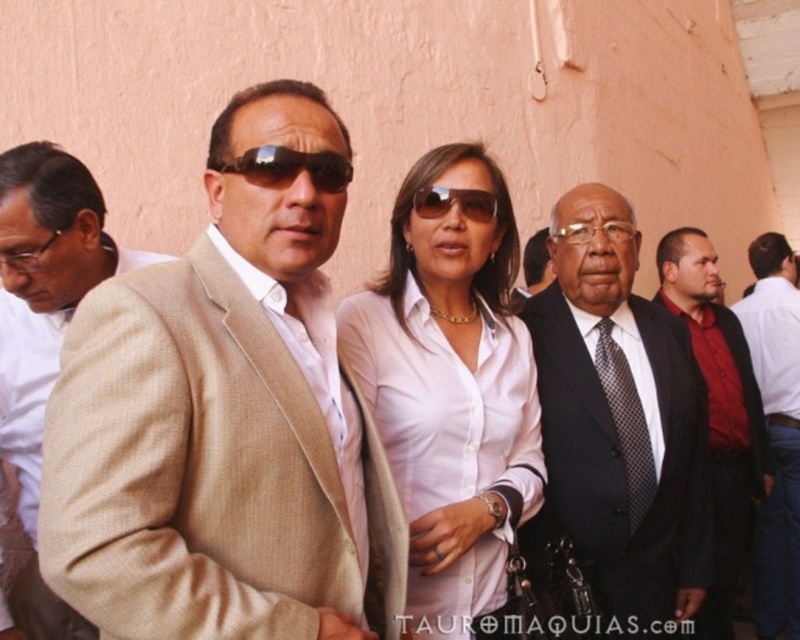
Question: Does dark blue suit at center appear under beige textured suit at left?

Choices:
 (A) yes
 (B) no

Answer: (A)

Question: Does dark red shirt at center lie behind black reflective sunglasses at center?

Choices:
 (A) yes
 (B) no

Answer: (A)

Question: Based on their relative distances, which object is farther from the white satin blouse at center?

Choices:
 (A) sunglasses at center
 (B) beige textured suit at center

Answer: (B)

Question: Can you confirm if beige textured suit at left is positioned to the right of transparent plastic glasses at center?

Choices:
 (A) no
 (B) yes

Answer: (A)

Question: Which point is closer to the camera taking this photo?

Choices:
 (A) (446, 211)
 (B) (210, 204)
 (C) (612, 221)

Answer: (B)

Question: Among these objects, which one is nearest to the camera?

Choices:
 (A) beige textured suit at center
 (B) dark red shirt at center
 (C) red shirt at center
 (D) dark blue suit at center

Answer: (A)